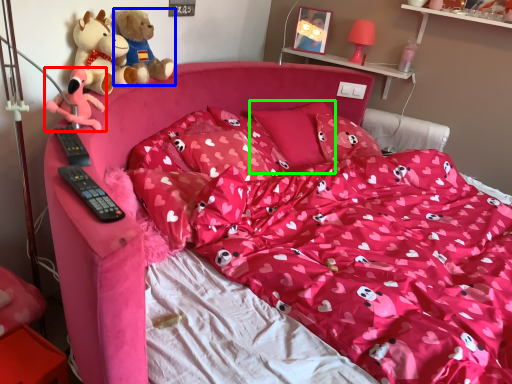
Question: Which object is the farthest from toy (highlighted by a red box)? Choose among these: teddy bear (highlighted by a blue box) or pillow (highlighted by a green box).

Choices:
 (A) teddy bear
 (B) pillow

Answer: (B)